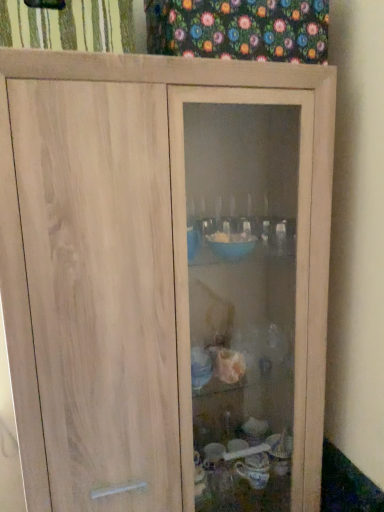
Question: From a real-world perspective, is green striped fabric at upper left, the 2th curtain in the right-to-left sequence, above or below floral fabric at upper center, which is counted as the second curtain, starting from the left?

Choices:
 (A) above
 (B) below

Answer: (B)

Question: Relative to floral fabric at upper center, which is counted as the second curtain, starting from the left, is green striped fabric at upper left, the 2th curtain in the right-to-left sequence, in front or behind?

Choices:
 (A) behind
 (B) front

Answer: (B)

Question: Based on their sizes in the image, would you say green striped fabric at upper left, the 2th curtain in the right-to-left sequence, is bigger or smaller than floral fabric at upper center, which is counted as the 1th curtain, starting from the right?

Choices:
 (A) small
 (B) big

Answer: (A)

Question: Is floral fabric at upper center, which is counted as the 1th curtain, starting from the right, situated inside green striped fabric at upper left, the 2th curtain in the right-to-left sequence, or outside?

Choices:
 (A) inside
 (B) outside

Answer: (B)

Question: From the image's perspective, is floral fabric at upper center, which is counted as the 1th curtain, starting from the right, located above or below green striped fabric at upper left, the 2th curtain in the right-to-left sequence?

Choices:
 (A) above
 (B) below

Answer: (A)

Question: In terms of width, does floral fabric at upper center, which is counted as the second curtain, starting from the left, look wider or thinner when compared to green striped fabric at upper left, arranged as the 1th curtain when viewed from the left?

Choices:
 (A) thin
 (B) wide

Answer: (A)

Question: Does point (165, 19) appear closer or farther from the camera than point (16, 31)?

Choices:
 (A) farther
 (B) closer

Answer: (A)